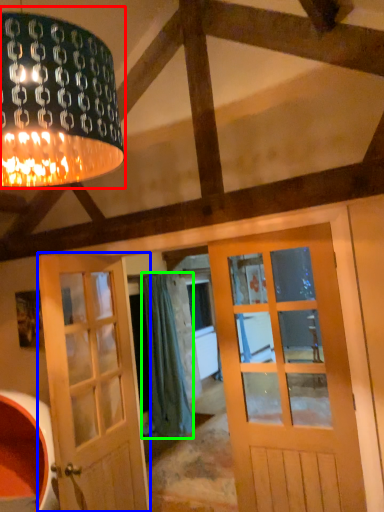
Question: Considering the real-world distances, which object is closest to lamp (highlighted by a red box)? door (highlighted by a blue box) or curtain (highlighted by a green box).

Choices:
 (A) door
 (B) curtain

Answer: (A)